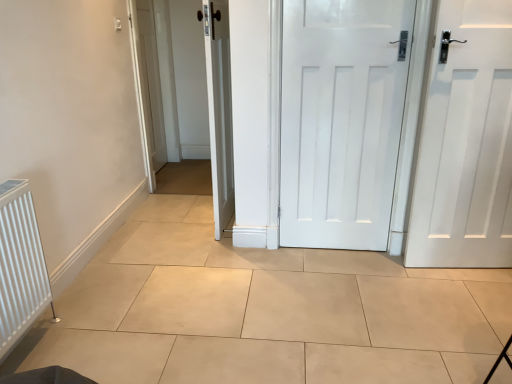
Locate an element on the screen. This screenshot has height=384, width=512. free space in front of white matte door at center, marked as the second door in a left-to-right arrangement is located at coordinates (349, 283).